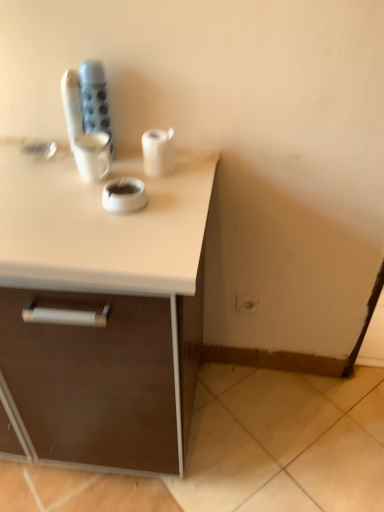
Question: Should I look upward or downward to see white matte paper towel at center?

Choices:
 (A) up
 (B) down

Answer: (A)

Question: Is white matte ashtray at center positioned with its back to white plastic electric outlet at lower right?

Choices:
 (A) no
 (B) yes

Answer: (A)

Question: From the image's perspective, is white matte ashtray at center beneath white plastic electric outlet at lower right?

Choices:
 (A) no
 (B) yes

Answer: (A)

Question: From a real-world perspective, is white matte ashtray at center over white plastic electric outlet at lower right?

Choices:
 (A) yes
 (B) no

Answer: (A)

Question: Does white matte ashtray at center have a lesser width compared to white plastic electric outlet at lower right?

Choices:
 (A) no
 (B) yes

Answer: (A)

Question: Is white plastic electric outlet at lower right a part of white matte ashtray at center?

Choices:
 (A) yes
 (B) no

Answer: (B)

Question: From a real-world perspective, is white matte ashtray at center under white plastic electric outlet at lower right?

Choices:
 (A) no
 (B) yes

Answer: (A)

Question: Is white matte paper towel at center outside white plastic electric outlet at lower right?

Choices:
 (A) yes
 (B) no

Answer: (A)

Question: Is white matte paper towel at center oriented towards white plastic electric outlet at lower right?

Choices:
 (A) yes
 (B) no

Answer: (B)

Question: Is white matte paper towel at center further to camera compared to white plastic electric outlet at lower right?

Choices:
 (A) yes
 (B) no

Answer: (B)

Question: Are white matte paper towel at center and white plastic electric outlet at lower right making contact?

Choices:
 (A) no
 (B) yes

Answer: (A)

Question: Considering the relative sizes of white matte paper towel at center and white plastic electric outlet at lower right in the image provided, is white matte paper towel at center smaller than white plastic electric outlet at lower right?

Choices:
 (A) no
 (B) yes

Answer: (A)

Question: From the image's perspective, is white matte paper towel at center over white plastic electric outlet at lower right?

Choices:
 (A) yes
 (B) no

Answer: (A)

Question: Is white plastic electric outlet at lower right located outside white matte paper towel at center?

Choices:
 (A) no
 (B) yes

Answer: (B)